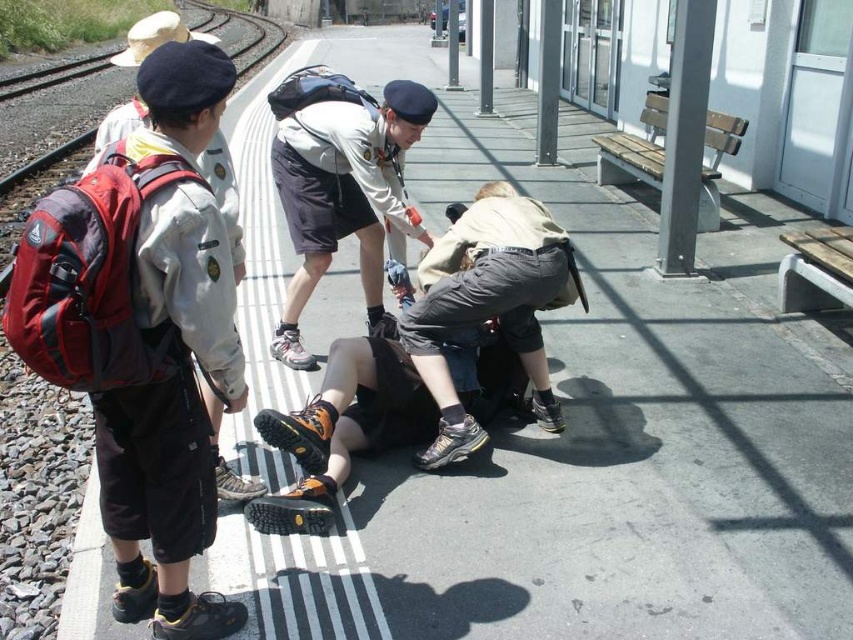
Question: Is light gray uniform at center to the right of khaki cotton shirt at center from the viewer's perspective?

Choices:
 (A) no
 (B) yes

Answer: (A)

Question: Does light gray uniform at center have a greater width compared to khaki cotton shirt at center?

Choices:
 (A) no
 (B) yes

Answer: (B)

Question: Estimate the real-world distances between objects in this image. Which object is farther from the matte gray uniform at left?

Choices:
 (A) light gray uniform at center
 (B) khaki cotton shirt at center

Answer: (B)

Question: Is light gray uniform at center above matte gray uniform at left?

Choices:
 (A) yes
 (B) no

Answer: (B)

Question: Among these points, which one is farthest from the camera?

Choices:
 (A) (421, 376)
 (B) (322, 116)
 (C) (140, 104)

Answer: (B)

Question: Which object is positioned farthest from the khaki cotton shirt at center?

Choices:
 (A) light gray uniform at center
 (B) matte gray uniform at left

Answer: (B)